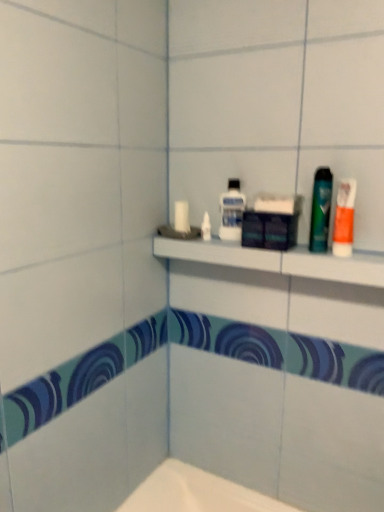
Identify the location of green glossy mouthwash at right, marked as the second mouthwash in a back-to-front arrangement. (321, 210).

What do you see at coordinates (231, 211) in the screenshot? I see `clear plastic mouthwash at upper center, positioned as the first mouthwash in left-to-right order` at bounding box center [231, 211].

Locate an element on the screen. The height and width of the screenshot is (512, 384). clear plastic mouthwash at upper center, positioned as the second mouthwash in right-to-left order is located at coordinates (231, 211).

Locate an element on the screen. Image resolution: width=384 pixels, height=512 pixels. orange matte toothpaste at right is located at coordinates (344, 218).

From a real-world perspective, which object rests below the other?

orange matte toothpaste at right is physically lower.

Is orange matte toothpaste at right positioned beyond the bounds of clear plastic mouthwash at upper center, positioned as the second mouthwash in right-to-left order?

Yes, orange matte toothpaste at right is located beyond the bounds of clear plastic mouthwash at upper center, positioned as the second mouthwash in right-to-left order.

Is there a large distance between orange matte toothpaste at right and clear plastic mouthwash at upper center, positioned as the first mouthwash in left-to-right order?

No.

Is green glossy mouthwash at right, which is counted as the first mouthwash, starting from the front, to the left of orange matte toothpaste at right from the viewer's perspective?

Correct, you'll find green glossy mouthwash at right, which is counted as the first mouthwash, starting from the front, to the left of orange matte toothpaste at right.

Is green glossy mouthwash at right, which ranks as the 1th mouthwash in right-to-left order, spatially inside orange matte toothpaste at right, or outside of it?

green glossy mouthwash at right, which ranks as the 1th mouthwash in right-to-left order, exists outside the volume of orange matte toothpaste at right.

Is green glossy mouthwash at right, which ranks as the 1th mouthwash in right-to-left order, positioned in front of orange matte toothpaste at right?

No, it is behind orange matte toothpaste at right.

From the image's perspective, is green glossy mouthwash at right, which is counted as the first mouthwash, starting from the front, above or below orange matte toothpaste at right?

Clearly, from the image's perspective, green glossy mouthwash at right, which is counted as the first mouthwash, starting from the front, is above orange matte toothpaste at right.

Is orange matte toothpaste at right a part of white plastic shelf at upper center?

No.

From the image's perspective, is white plastic shelf at upper center located beneath orange matte toothpaste at right?

Indeed, from the image's perspective, white plastic shelf at upper center is shown beneath orange matte toothpaste at right.

From a real-world perspective, who is located higher, white plastic shelf at upper center or orange matte toothpaste at right?

From a 3D spatial view, orange matte toothpaste at right is above.

Is orange matte toothpaste at right at the back of white plastic shelf at upper center?

white plastic shelf at upper center is not turned away from orange matte toothpaste at right.

Which object is closer to the camera taking this photo, orange matte toothpaste at right or green glossy mouthwash at right, acting as the second mouthwash starting from the left?

orange matte toothpaste at right is in front.

Considering the relative sizes of orange matte toothpaste at right and green glossy mouthwash at right, which ranks as the 1th mouthwash in right-to-left order, in the image provided, is orange matte toothpaste at right bigger than green glossy mouthwash at right, which ranks as the 1th mouthwash in right-to-left order,?

Indeed, orange matte toothpaste at right has a larger size compared to green glossy mouthwash at right, which ranks as the 1th mouthwash in right-to-left order.

Is orange matte toothpaste at right taller than green glossy mouthwash at right, acting as the second mouthwash starting from the left?

Incorrect, the height of orange matte toothpaste at right is not larger of that of green glossy mouthwash at right, acting as the second mouthwash starting from the left.

Considering the positions of points (335, 233) and (318, 203), is point (335, 233) closer to camera compared to point (318, 203)?

Yes, it is.

Can you tell me how much clear plastic mouthwash at upper center, which is the second mouthwash in front-to-back order, and green glossy mouthwash at right, which is counted as the first mouthwash, starting from the front, differ in facing direction?

There is a 6.27-degree angle between the facing directions of clear plastic mouthwash at upper center, which is the second mouthwash in front-to-back order, and green glossy mouthwash at right, which is counted as the first mouthwash, starting from the front.

Does clear plastic mouthwash at upper center, which is the second mouthwash in front-to-back order, touch green glossy mouthwash at right, which is counted as the first mouthwash, starting from the front?

No, clear plastic mouthwash at upper center, which is the second mouthwash in front-to-back order, is not touching green glossy mouthwash at right, which is counted as the first mouthwash, starting from the front.

Between clear plastic mouthwash at upper center, marked as the 1th mouthwash in a back-to-front arrangement, and green glossy mouthwash at right, acting as the second mouthwash starting from the left, which one appears on the right side from the viewer's perspective?

green glossy mouthwash at right, acting as the second mouthwash starting from the left.

Which is more to the left, green glossy mouthwash at right, which ranks as the 1th mouthwash in right-to-left order, or white plastic shelf at upper center?

Positioned to the left is white plastic shelf at upper center.

Between green glossy mouthwash at right, which is counted as the first mouthwash, starting from the front, and white plastic shelf at upper center, which one has larger size?

white plastic shelf at upper center is bigger.

From a real-world perspective, is green glossy mouthwash at right, marked as the second mouthwash in a back-to-front arrangement, above or below white plastic shelf at upper center?

Clearly, from a real-world perspective, green glossy mouthwash at right, marked as the second mouthwash in a back-to-front arrangement, is above white plastic shelf at upper center.

From the image's perspective, does green glossy mouthwash at right, which ranks as the 1th mouthwash in right-to-left order, appear higher than white plastic shelf at upper center?

Yes, from the image's perspective, green glossy mouthwash at right, which ranks as the 1th mouthwash in right-to-left order, is above white plastic shelf at upper center.

From the image's perspective, is clear plastic mouthwash at upper center, marked as the 1th mouthwash in a back-to-front arrangement, under orange matte toothpaste at right?

No.

Image resolution: width=384 pixels, height=512 pixels. Find the location of `toiletry to the right of clear plastic mouthwash at upper center, positioned as the second mouthwash in right-to-left order`. toiletry to the right of clear plastic mouthwash at upper center, positioned as the second mouthwash in right-to-left order is located at coordinates (344, 218).

Would you say clear plastic mouthwash at upper center, which is the second mouthwash in front-to-back order, is to the left or to the right of orange matte toothpaste at right in the picture?

From the image, it's evident that clear plastic mouthwash at upper center, which is the second mouthwash in front-to-back order, is to the left of orange matte toothpaste at right.

Are clear plastic mouthwash at upper center, positioned as the second mouthwash in right-to-left order, and orange matte toothpaste at right located far from each other?

clear plastic mouthwash at upper center, positioned as the second mouthwash in right-to-left order, is near orange matte toothpaste at right, not far away.

Identify the location of toiletry that appears in front of the clear plastic mouthwash at upper center, positioned as the second mouthwash in right-to-left order. (344, 218).

From the orange matte toothpaste at right, count the 1st mouthwash to the left and point to it. Please provide its 2D coordinates.

[(321, 210)]

Based on the photo, which object lies further to the anchor point clear plastic mouthwash at upper center, which is the second mouthwash in front-to-back order, white plastic shelf at upper center or green glossy mouthwash at right, acting as the second mouthwash starting from the left?

green glossy mouthwash at right, acting as the second mouthwash starting from the left, lies further to clear plastic mouthwash at upper center, which is the second mouthwash in front-to-back order, than the other object.

From the image, which object appears to be farther from orange matte toothpaste at right, green glossy mouthwash at right, acting as the second mouthwash starting from the left, or white plastic shelf at upper center?

Based on the image, white plastic shelf at upper center appears to be further to orange matte toothpaste at right.

When comparing their distances from white plastic shelf at upper center, does clear plastic mouthwash at upper center, positioned as the second mouthwash in right-to-left order, or orange matte toothpaste at right seem further?

orange matte toothpaste at right lies further to white plastic shelf at upper center than the other object.

Which object lies nearer to the anchor point green glossy mouthwash at right, which ranks as the 1th mouthwash in right-to-left order, white plastic shelf at upper center or clear plastic mouthwash at upper center, marked as the 1th mouthwash in a back-to-front arrangement?

white plastic shelf at upper center is closer to green glossy mouthwash at right, which ranks as the 1th mouthwash in right-to-left order.

Looking at the image, which one is located further to green glossy mouthwash at right, which is counted as the first mouthwash, starting from the front, clear plastic mouthwash at upper center, positioned as the second mouthwash in right-to-left order, or white plastic shelf at upper center?

clear plastic mouthwash at upper center, positioned as the second mouthwash in right-to-left order, lies further to green glossy mouthwash at right, which is counted as the first mouthwash, starting from the front, than the other object.

Considering their positions, is white plastic shelf at upper center positioned further to green glossy mouthwash at right, which is counted as the first mouthwash, starting from the front, than orange matte toothpaste at right?

The object further to green glossy mouthwash at right, which is counted as the first mouthwash, starting from the front, is white plastic shelf at upper center.

Consider the image. From the image, which object appears to be nearer to clear plastic mouthwash at upper center, marked as the 1th mouthwash in a back-to-front arrangement, orange matte toothpaste at right or green glossy mouthwash at right, acting as the second mouthwash starting from the left?

green glossy mouthwash at right, acting as the second mouthwash starting from the left.

Considering their positions, is orange matte toothpaste at right positioned closer to white plastic shelf at upper center than green glossy mouthwash at right, which is counted as the first mouthwash, starting from the front?

The object closer to white plastic shelf at upper center is green glossy mouthwash at right, which is counted as the first mouthwash, starting from the front.

Where is `mouthwash situated between white plastic shelf at upper center and orange matte toothpaste at right from left to right`? The width and height of the screenshot is (384, 512). mouthwash situated between white plastic shelf at upper center and orange matte toothpaste at right from left to right is located at coordinates (321, 210).

At what (x,y) coordinates should I click in order to perform the action: click on shelf situated between clear plastic mouthwash at upper center, marked as the 1th mouthwash in a back-to-front arrangement, and orange matte toothpaste at right from left to right. Please return your answer as a coordinate pair (x, y). Looking at the image, I should click on (278, 260).

Locate an element on the screen. The height and width of the screenshot is (512, 384). mouthwash between clear plastic mouthwash at upper center, which is the second mouthwash in front-to-back order, and orange matte toothpaste at right is located at coordinates 321,210.

Where is `shelf situated between clear plastic mouthwash at upper center, marked as the 1th mouthwash in a back-to-front arrangement, and green glossy mouthwash at right, which is counted as the first mouthwash, starting from the front, from left to right`? The width and height of the screenshot is (384, 512). shelf situated between clear plastic mouthwash at upper center, marked as the 1th mouthwash in a back-to-front arrangement, and green glossy mouthwash at right, which is counted as the first mouthwash, starting from the front, from left to right is located at coordinates (278, 260).